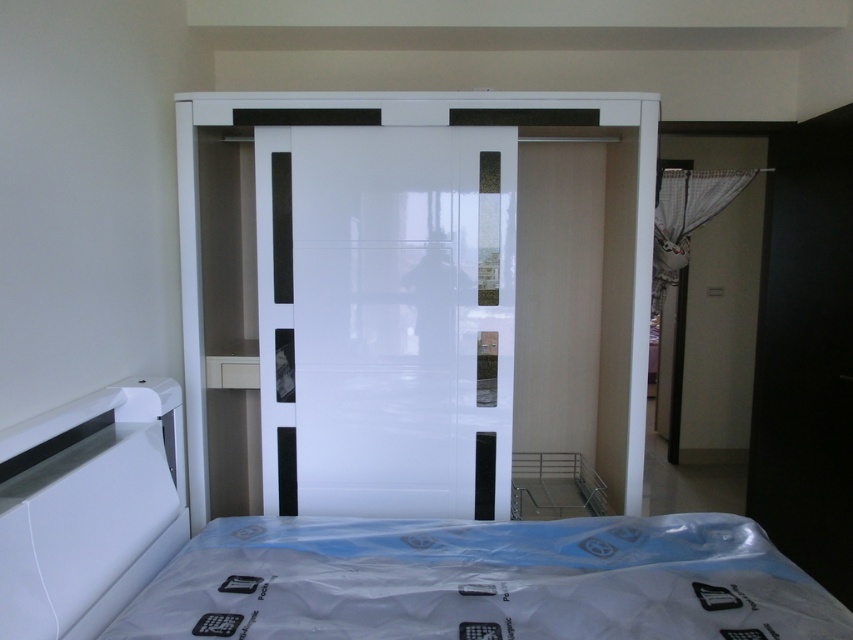
Question: Which point is closer to the camera?

Choices:
 (A) (641, 307)
 (B) (115, 612)

Answer: (B)

Question: Is white glossy bed at center above glossy white glass door at center?

Choices:
 (A) no
 (B) yes

Answer: (A)

Question: Which object is the closest to the white glossy bed at center?

Choices:
 (A) glossy white glass door at center
 (B) glossy white wardrobe at center

Answer: (A)

Question: Does glossy white glass door at center appear under glossy white wardrobe at center?

Choices:
 (A) yes
 (B) no

Answer: (A)

Question: Which point is farther to the camera?

Choices:
 (A) (184, 394)
 (B) (299, 483)
 (C) (55, 588)

Answer: (B)

Question: Does white glossy bed at center have a smaller size compared to glossy white glass door at center?

Choices:
 (A) no
 (B) yes

Answer: (A)